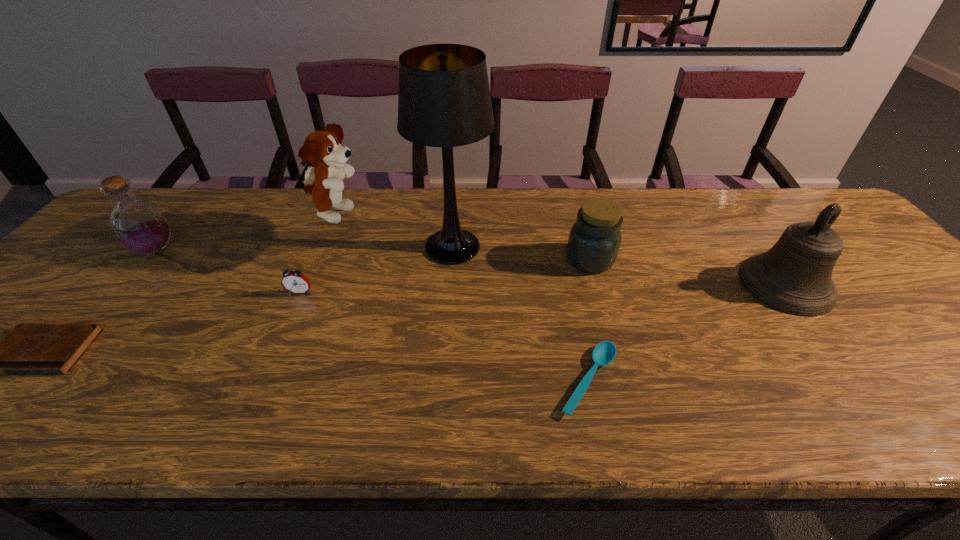
The width and height of the screenshot is (960, 540). Identify the location of table lamp. (444, 100).

At what (x,y) coordinates should I click in order to perform the action: click on the tallest object. Please return your answer as a coordinate pair (x, y). Looking at the image, I should click on (444, 100).

The width and height of the screenshot is (960, 540). I want to click on puppy, so click(x=322, y=149).

This screenshot has height=540, width=960. Find the location of `bell`. bell is located at coordinates (794, 276).

Locate an element on the screen. bottle is located at coordinates (138, 225).

This screenshot has height=540, width=960. Find the location of `the fifth tallest object`. the fifth tallest object is located at coordinates (594, 240).

Image resolution: width=960 pixels, height=540 pixels. I want to click on the sixth tallest object, so click(x=295, y=282).

Find the location of `spoon`. spoon is located at coordinates (603, 354).

Where is `vacant space positioned 0.060m on the back of the tallest object`? vacant space positioned 0.060m on the back of the tallest object is located at coordinates (455, 212).

Find the location of a particular element. vacant space located on the face of the puppy is located at coordinates click(405, 215).